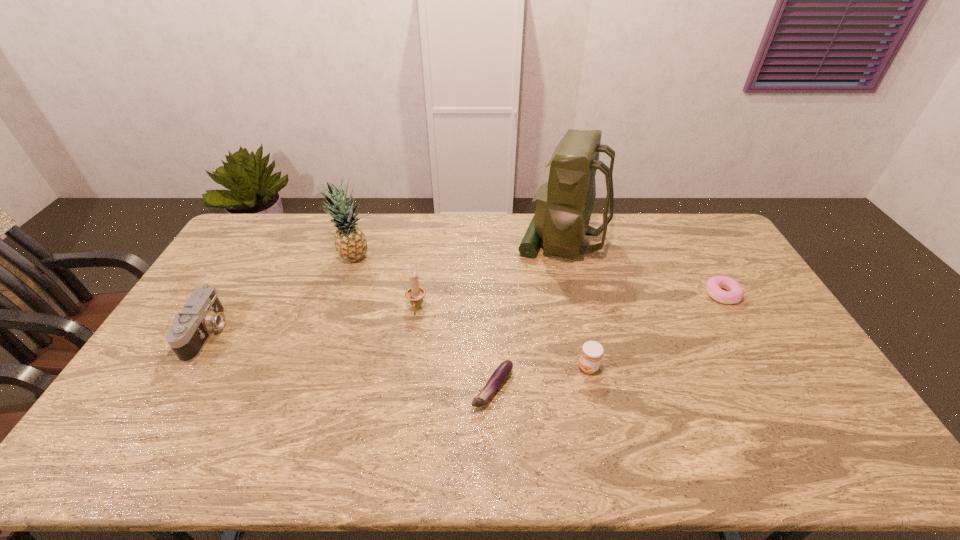
The width and height of the screenshot is (960, 540). Identify the location of vacant area that lies between the third shortest object and the third object from left to right. coord(503,338).

Identify the location of vacant area that lies between the leftmost object and the third object from left to right. [312, 321].

Image resolution: width=960 pixels, height=540 pixels. Find the location of `empty location between the third shortest object and the second tallest object`. empty location between the third shortest object and the second tallest object is located at coordinates (470, 313).

You are a GUI agent. You are given a task and a screenshot of the screen. Output one action in this format:
    pyautogui.click(x=<x>, y=<y>)
    Task: Click on the vacant space that's between the second tallest object and the fourth tallest object
    The image size is (960, 540).
    Given the screenshot: What is the action you would take?
    pyautogui.click(x=280, y=295)

Locate an element on the screen. The width and height of the screenshot is (960, 540). free space between the pastry and the eggplant is located at coordinates (608, 341).

The height and width of the screenshot is (540, 960). In order to click on vacant space that's between the eggplant and the backpack in this screenshot , I will do `click(527, 314)`.

At what (x,y) coordinates should I click in order to perform the action: click on free area in between the fourth shortest object and the fourth object from right to left. Please return your answer as a coordinate pair (x, y). The width and height of the screenshot is (960, 540). Looking at the image, I should click on (350, 361).

What are the coordinates of `vacant space in between the jam and the backpack` in the screenshot? It's located at (575, 303).

You are a GUI agent. You are given a task and a screenshot of the screen. Output one action in this format:
    pyautogui.click(x=<x>, y=<y>)
    Task: Click on the vacant space in between the rightmost object and the backpack
    This screenshot has width=960, height=540.
    Given the screenshot: What is the action you would take?
    pyautogui.click(x=642, y=267)

Locate which object ranks in proximity to the camera. Please provide its 2D coordinates. Your answer should be formatted as a tuple, i.e. [(x, y)], where the tuple contains the x and y coordinates of a point satisfying the conditions above.

[(350, 242)]